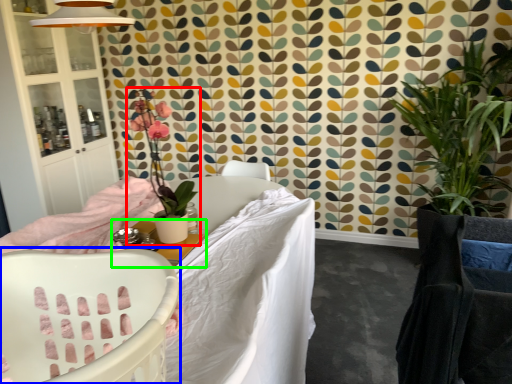
Question: Which object is positioned closest to houseplant (highlighted by a red box)? Select from chair (highlighted by a blue box) and table (highlighted by a green box).

Choices:
 (A) chair
 (B) table

Answer: (B)